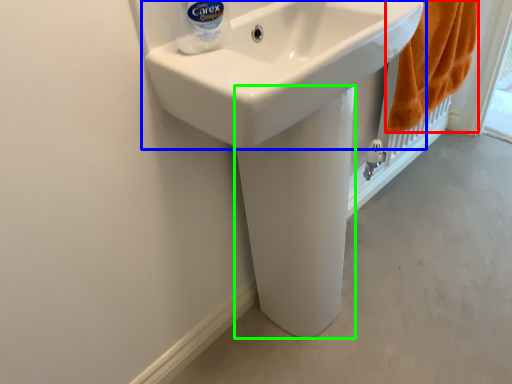
Question: Estimate the real-world distances between objects in this image. Which object is farther from bath towel (highlighted by a red box), sink (highlighted by a blue box) or bidet (highlighted by a green box)?

Choices:
 (A) sink
 (B) bidet

Answer: (B)